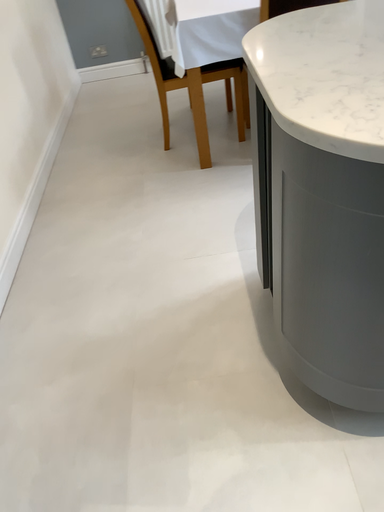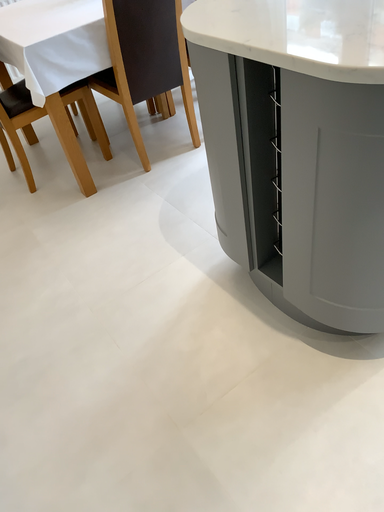
Question: Which way did the camera rotate in the video?

Choices:
 (A) rotated upward
 (B) rotated downward

Answer: (A)